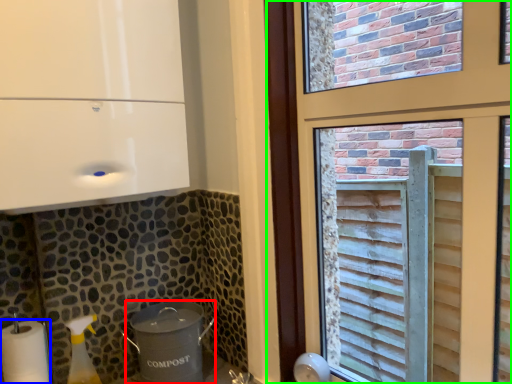
Question: Which is farther away from appliance (highlighted by a red box)? paper towel (highlighted by a blue box) or window (highlighted by a green box)?

Choices:
 (A) paper towel
 (B) window

Answer: (B)